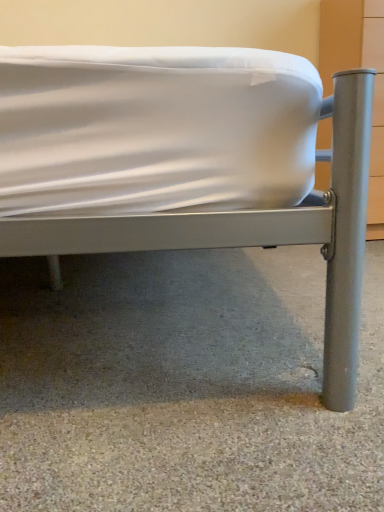
Question: Does gray carpet at lower center have a lesser width compared to metallic gray bed at center?

Choices:
 (A) no
 (B) yes

Answer: (A)

Question: Is gray carpet at lower center at the right side of metallic gray bed at center?

Choices:
 (A) no
 (B) yes

Answer: (B)

Question: Does gray carpet at lower center have a greater height compared to metallic gray bed at center?

Choices:
 (A) no
 (B) yes

Answer: (A)

Question: From a real-world perspective, is gray carpet at lower center located higher than metallic gray bed at center?

Choices:
 (A) no
 (B) yes

Answer: (A)

Question: Is there a large distance between gray carpet at lower center and metallic gray bed at center?

Choices:
 (A) no
 (B) yes

Answer: (A)

Question: Is gray carpet at lower center in front of metallic gray bed at center?

Choices:
 (A) yes
 (B) no

Answer: (B)

Question: From the image's perspective, is metallic gray bed at center on gray carpet at lower center?

Choices:
 (A) no
 (B) yes

Answer: (B)

Question: Is gray carpet at lower center located within metallic gray bed at center?

Choices:
 (A) yes
 (B) no

Answer: (B)

Question: Considering the relative sizes of metallic gray bed at center and gray carpet at lower center in the image provided, is metallic gray bed at center thinner than gray carpet at lower center?

Choices:
 (A) yes
 (B) no

Answer: (A)

Question: Is metallic gray bed at center taller than gray carpet at lower center?

Choices:
 (A) yes
 (B) no

Answer: (A)

Question: Is metallic gray bed at center directly adjacent to gray carpet at lower center?

Choices:
 (A) no
 (B) yes

Answer: (A)

Question: Is metallic gray bed at center smaller than gray carpet at lower center?

Choices:
 (A) no
 (B) yes

Answer: (A)

Question: Considering the relative positions of gray carpet at lower center and metallic gray bed at center in the image provided, is gray carpet at lower center to the left or to the right of metallic gray bed at center?

Choices:
 (A) left
 (B) right

Answer: (B)